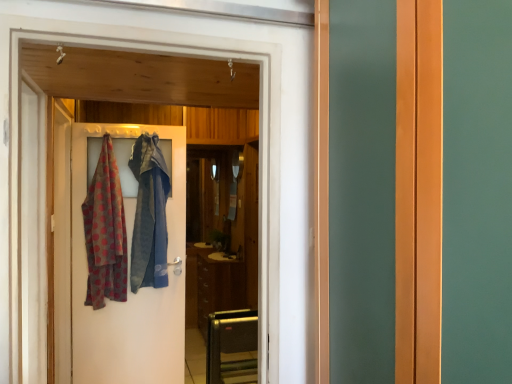
Question: From the image's perspective, is wooden door at center located above or below polka dot fabric scarf at left?

Choices:
 (A) below
 (B) above

Answer: (B)

Question: From a real-world perspective, relative to polka dot fabric scarf at left, is wooden door at center vertically above or below?

Choices:
 (A) below
 (B) above

Answer: (B)

Question: Which is nearer to the polka dot fabric at left?

Choices:
 (A) metallic silver toaster at lower center
 (B) wooden door at center
 (C) brown matte cabinet at center
 (D) polka dot fabric scarf at left

Answer: (D)

Question: Which is farther from the brown matte cabinet at center?

Choices:
 (A) metallic silver toaster at lower center
 (B) polka dot fabric scarf at left
 (C) polka dot fabric at left
 (D) wooden door at center

Answer: (D)